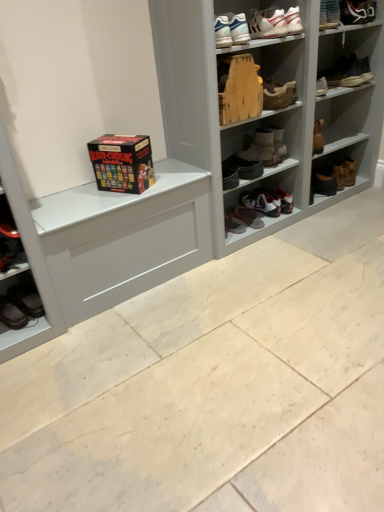
What is the approximate height of black leather boot at lower right, which is counted as the 12th footwear, starting from the left?

5.79 inches.

The height and width of the screenshot is (512, 384). What do you see at coordinates (261, 148) in the screenshot? I see `leather boots at center, which appears as the ninth footwear when viewed from the right` at bounding box center [261, 148].

The width and height of the screenshot is (384, 512). Identify the location of black leather shoes at lower left, which appears as the first footwear when viewed from the left. (20, 306).

Image resolution: width=384 pixels, height=512 pixels. Find the location of `white leather sneaker at upper right, acting as the 11th footwear starting from the left`. white leather sneaker at upper right, acting as the 11th footwear starting from the left is located at coordinates (346, 13).

This screenshot has height=512, width=384. What do you see at coordinates (278, 94) in the screenshot? I see `wooden shoe at upper center, acting as the 6th footwear starting from the right` at bounding box center [278, 94].

The width and height of the screenshot is (384, 512). What are the coordinates of `wooden shoe at upper center, acting as the 6th footwear starting from the right` in the screenshot? It's located at (278, 94).

What do you see at coordinates (261, 202) in the screenshot?
I see `white leather sneaker at center, placed as the sixth footwear when sorted from left to right` at bounding box center [261, 202].

The image size is (384, 512). Describe the element at coordinates (173, 155) in the screenshot. I see `white painted wood shelf at upper center` at that location.

The width and height of the screenshot is (384, 512). What are the coordinates of `black leather boot at lower right, which is counted as the 12th footwear, starting from the left` in the screenshot? It's located at (334, 176).

In terms of size, does black leather boots at center, the second footwear positioned from the left, appear bigger or smaller than white painted wood shelf at upper center?

black leather boots at center, the second footwear positioned from the left, is smaller than white painted wood shelf at upper center.

From a real-world perspective, who is located higher, black leather boots at center, the second footwear positioned from the left, or white painted wood shelf at upper center?

From a 3D spatial view, white painted wood shelf at upper center is above.

Does black leather boots at center, the twelfth footwear in the right-to-left sequence, contain white painted wood shelf at upper center?

No, white painted wood shelf at upper center is located outside of black leather boots at center, the twelfth footwear in the right-to-left sequence.

Can you confirm if leather boots at center, which appears as the ninth footwear when viewed from the right, is taller than matt black board game box at center?

No.

From the image's perspective, who appears lower, leather boots at center, marked as the fifth footwear in a left-to-right arrangement, or matt black board game box at center?

From the image's view, matt black board game box at center is below.

Is leather boots at center, which appears as the ninth footwear when viewed from the right, positioned far away from matt black board game box at center?

Actually, leather boots at center, which appears as the ninth footwear when viewed from the right, and matt black board game box at center are a little close together.

Is brown leather boot at upper right, which is the thirteenth footwear in left-to-right order, at the back of leather boots at center, which appears as the ninth footwear when viewed from the right?

leather boots at center, which appears as the ninth footwear when viewed from the right, does not have its back to brown leather boot at upper right, which is the thirteenth footwear in left-to-right order.

Is leather boots at center, which appears as the ninth footwear when viewed from the right, wider or thinner than brown leather boot at upper right, which is the thirteenth footwear in left-to-right order?

Considering their sizes, leather boots at center, which appears as the ninth footwear when viewed from the right, looks broader than brown leather boot at upper right, which is the thirteenth footwear in left-to-right order.

Between white leather sneakers at upper center, which is the seventh footwear in left-to-right order, and leather boots at center, which appears as the ninth footwear when viewed from the right, which one has less height?

white leather sneakers at upper center, which is the seventh footwear in left-to-right order, is shorter.

From the picture: Is white leather sneakers at upper center, which is the seventh footwear in left-to-right order, looking in the opposite direction of leather boots at center, marked as the fifth footwear in a left-to-right arrangement?

No, white leather sneakers at upper center, which is the seventh footwear in left-to-right order, is not facing the opposite direction of leather boots at center, marked as the fifth footwear in a left-to-right arrangement.

Considering the relative sizes of white leather sneakers at upper center, placed as the 7th footwear when sorted from right to left, and leather boots at center, marked as the fifth footwear in a left-to-right arrangement, in the image provided, is white leather sneakers at upper center, placed as the 7th footwear when sorted from right to left, bigger than leather boots at center, marked as the fifth footwear in a left-to-right arrangement,?

No, white leather sneakers at upper center, placed as the 7th footwear when sorted from right to left, is not bigger than leather boots at center, marked as the fifth footwear in a left-to-right arrangement.

From the image's perspective, between white leather sneakers at upper center, placed as the 7th footwear when sorted from right to left, and leather boots at center, which appears as the ninth footwear when viewed from the right, which one is located above?

white leather sneakers at upper center, placed as the 7th footwear when sorted from right to left, appears higher in the image.

Is black leather shoes at lower left, which ranks as the 13th footwear in right-to-left order, inside black leather shoe at center right, the 4th footwear when ordered from right to left?

No, black leather shoes at lower left, which ranks as the 13th footwear in right-to-left order, is not a part of black leather shoe at center right, the 4th footwear when ordered from right to left.

Is black leather shoe at center right, the tenth footwear from the left, taller or shorter than black leather shoes at lower left, which appears as the first footwear when viewed from the left?

In the image, black leather shoe at center right, the tenth footwear from the left, appears to be taller than black leather shoes at lower left, which appears as the first footwear when viewed from the left.

What's the angular difference between black leather shoe at center right, the 4th footwear when ordered from right to left, and black leather shoes at lower left, which appears as the first footwear when viewed from the left,'s facing directions?

2.55 degrees separate the facing orientations of black leather shoe at center right, the 4th footwear when ordered from right to left, and black leather shoes at lower left, which appears as the first footwear when viewed from the left.

Considering the positions of objects black leather shoe at center right, the 4th footwear when ordered from right to left, and black leather shoes at lower left, which ranks as the 13th footwear in right-to-left order, in the image provided, who is behind, black leather shoe at center right, the 4th footwear when ordered from right to left, or black leather shoes at lower left, which ranks as the 13th footwear in right-to-left order,?

Positioned behind is black leather shoe at center right, the 4th footwear when ordered from right to left.

In terms of width, does shiny brown shoe at center, the eleventh footwear positioned from the right, look wider or thinner when compared to matte white cabinet at lower left?

Clearly, shiny brown shoe at center, the eleventh footwear positioned from the right, has more width compared to matte white cabinet at lower left.

Considering the relative positions of shiny brown shoe at center, the eleventh footwear positioned from the right, and matte white cabinet at lower left in the image provided, is shiny brown shoe at center, the eleventh footwear positioned from the right, to the left or to the right of matte white cabinet at lower left?

Based on their positions, shiny brown shoe at center, the eleventh footwear positioned from the right, is located to the right of matte white cabinet at lower left.

Does point (232, 209) come closer to viewer compared to point (3, 200)?

No, it is not.

At what (x,y) coordinates should I click in order to perform the action: click on the 2nd footwear to the right of the matte white cabinet at lower left, counting from the anchor's position. Please return your answer as a coordinate pair (x, y). Looking at the image, I should click on (247, 216).

Is matt black board game box at center far away from black leather shoe at center right, the tenth footwear from the left?

matt black board game box at center is positioned a significant distance from black leather shoe at center right, the tenth footwear from the left.

How different are the orientations of matt black board game box at center and black leather shoe at center right, the 4th footwear when ordered from right to left, in degrees?

79 degrees separate the facing orientations of matt black board game box at center and black leather shoe at center right, the 4th footwear when ordered from right to left.

Does matt black board game box at center have a larger size compared to black leather shoe at center right, the tenth footwear from the left?

Yes.

What are the coordinates of `the 6th footwear directly beneath the matt black board game box at center (from a real-world perspective)` in the screenshot? It's located at (324, 182).

What are the coordinates of `footwear that is the 2nd one when counting downward from the white painted wood shelf at upper center (from the image's perspective)` in the screenshot? It's located at (244, 167).

From the image's perspective, which footwear is the 4th one above the matt black board game box at center? Please provide its 2D coordinates.

[(261, 148)]

Which object lies nearer to the anchor point black leather boot at lower right, which is counted as the 12th footwear, starting from the left, white painted wood shelf at upper center or black leather shoe at center right, the tenth footwear from the left?

The object closer to black leather boot at lower right, which is counted as the 12th footwear, starting from the left, is black leather shoe at center right, the tenth footwear from the left.

Based on their spatial positions, is black leather boots at center, the twelfth footwear in the right-to-left sequence, or white leather sneakers at upper center, which is the seventh footwear in left-to-right order, further from black leather shoes at lower left, which ranks as the 13th footwear in right-to-left order?

Based on the image, white leather sneakers at upper center, which is the seventh footwear in left-to-right order, appears to be further to black leather shoes at lower left, which ranks as the 13th footwear in right-to-left order.

Considering their positions, is leather boots at center, marked as the fifth footwear in a left-to-right arrangement, positioned further to matte white cabinet at lower left than white leather sneakers at upper center, placed as the tenth footwear when sorted from right to left?

The object further to matte white cabinet at lower left is white leather sneakers at upper center, placed as the tenth footwear when sorted from right to left.

Considering their positions, is white leather sneaker at upper right, acting as the 11th footwear starting from the left, positioned further to white leather sneakers at upper center, which is counted as the 4th footwear, starting from the left, than white leather sneakers at upper center, which is the seventh footwear in left-to-right order?

white leather sneaker at upper right, acting as the 11th footwear starting from the left.

Estimate the real-world distances between objects in this image. Which object is closer to white leather sneakers at upper center, which is the seventh footwear in left-to-right order, black leather shoes at lower left, which ranks as the 13th footwear in right-to-left order, or wooden shoe at upper center, positioned as the 8th footwear in left-to-right order?

The object closer to white leather sneakers at upper center, which is the seventh footwear in left-to-right order, is wooden shoe at upper center, positioned as the 8th footwear in left-to-right order.

Considering their positions, is leather boots at center, which appears as the ninth footwear when viewed from the right, positioned further to white leather sneaker at upper right, the third footwear when ordered from right to left, than black leather shoe at center right, the tenth footwear from the left?

black leather shoe at center right, the tenth footwear from the left, is further to white leather sneaker at upper right, the third footwear when ordered from right to left.

Looking at the image, which one is located closer to shiny brown shoe at center, the 3th footwear positioned from the left, white leather sneaker at upper right, acting as the 11th footwear starting from the left, or matt black board game box at center?

matt black board game box at center.

Which object lies further to the anchor point white leather sneaker at upper right, acting as the 11th footwear starting from the left, white leather sneaker at center, placed as the sixth footwear when sorted from left to right, or black leather boots at center, the second footwear positioned from the left?

Based on the image, white leather sneaker at center, placed as the sixth footwear when sorted from left to right, appears to be further to white leather sneaker at upper right, acting as the 11th footwear starting from the left.

Where is `box between white painted wood shelf at upper center and black leather boot at lower right, the second footwear viewed from the right, from front to back`? This screenshot has width=384, height=512. box between white painted wood shelf at upper center and black leather boot at lower right, the second footwear viewed from the right, from front to back is located at coordinates pos(122,163).

The width and height of the screenshot is (384, 512). I want to click on cabinet between black leather shoes at lower left, which ranks as the 13th footwear in right-to-left order, and white leather sneaker at upper right, acting as the 11th footwear starting from the left, in the horizontal direction, so click(9, 240).

Where is `cabinet positioned between white painted wood shelf at upper center and white leather sneaker at center, the 9th footwear in the left-to-right sequence, from near to far`? Image resolution: width=384 pixels, height=512 pixels. cabinet positioned between white painted wood shelf at upper center and white leather sneaker at center, the 9th footwear in the left-to-right sequence, from near to far is located at coordinates (9, 240).

Locate an element on the screen. This screenshot has height=512, width=384. cabinet positioned between white painted wood shelf at upper center and shiny brown shoe at center, the eleventh footwear positioned from the right, from near to far is located at coordinates (x=9, y=240).